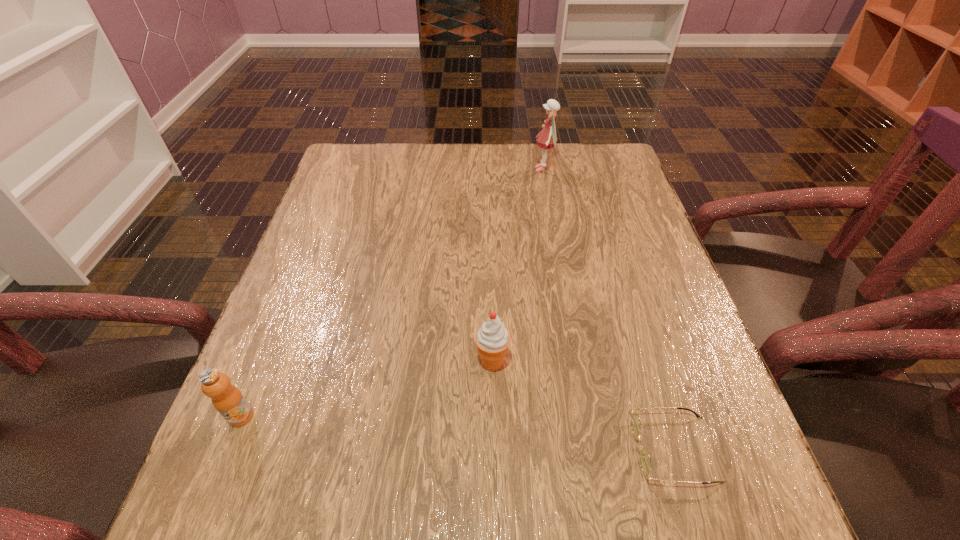
The width and height of the screenshot is (960, 540). In the image, there is a desktop. Find the location of `vacant space at the far edge`. vacant space at the far edge is located at coordinates (528, 179).

In the image, there is a desktop. Where is `vacant space at the near edge`? The width and height of the screenshot is (960, 540). vacant space at the near edge is located at coordinates (604, 494).

Image resolution: width=960 pixels, height=540 pixels. Find the location of `vacant region at the left edge of the desktop`. vacant region at the left edge of the desktop is located at coordinates (378, 200).

In the image, there is a desktop. At what (x,y) coordinates should I click in order to perform the action: click on blank space at the right edge. Please return your answer as a coordinate pair (x, y). This screenshot has width=960, height=540. Looking at the image, I should click on (683, 343).

In the image, there is a desktop. Where is `vacant space at the far left corner`? This screenshot has width=960, height=540. vacant space at the far left corner is located at coordinates (360, 172).

Identify the location of free space at the near left corner of the desktop. (252, 524).

Find the location of a particular element. free space between the orange juice and the icecream is located at coordinates (367, 389).

I want to click on unoccupied area between the icecream and the rightmost object, so click(x=583, y=406).

At what (x,y) coordinates should I click in order to perform the action: click on empty location between the leftmost object and the spectacles. Please return your answer as a coordinate pair (x, y). Image resolution: width=960 pixels, height=540 pixels. Looking at the image, I should click on (458, 433).

I want to click on vacant area between the orange juice and the shortest object, so click(458, 433).